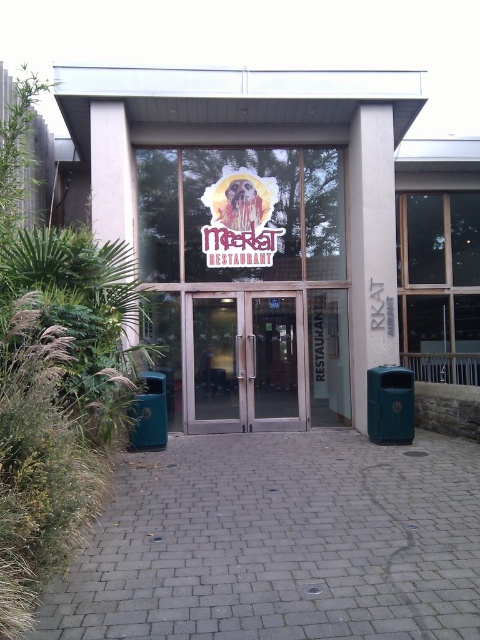
Question: Among these objects, which one is nearest to the camera?

Choices:
 (A) transparent glass door at center
 (B) transparent glass doors at center
 (C) metallic glass door at center

Answer: (B)

Question: Which object is the closest to the metallic glass door at center?

Choices:
 (A) transparent glass door at center
 (B) transparent glass doors at center

Answer: (B)

Question: Which object is closer to the camera taking this photo?

Choices:
 (A) metallic glass door at center
 (B) transparent glass doors at center

Answer: (B)

Question: Does transparent glass doors at center appear over transparent glass door at center?

Choices:
 (A) yes
 (B) no

Answer: (B)

Question: Where is metallic glass door at center located in relation to transparent glass door at center in the image?

Choices:
 (A) above
 (B) below

Answer: (B)

Question: Is transparent glass doors at center bigger than transparent glass door at center?

Choices:
 (A) yes
 (B) no

Answer: (A)